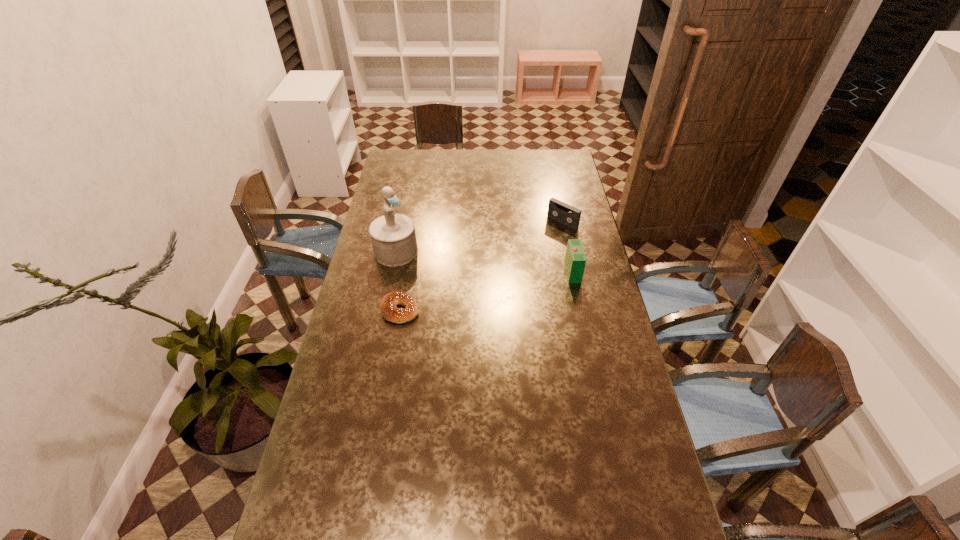
In order to click on bagel in this screenshot , I will do `click(388, 306)`.

The width and height of the screenshot is (960, 540). In order to click on the shortest object in this screenshot , I will do click(388, 306).

At what (x,y) coordinates should I click in order to perform the action: click on the third shortest object. Please return your answer as a coordinate pair (x, y). The width and height of the screenshot is (960, 540). Looking at the image, I should click on coord(575,260).

Locate an element on the screen. The width and height of the screenshot is (960, 540). the tallest object is located at coordinates (393, 237).

At what (x,y) coordinates should I click in order to perform the action: click on the third tallest object. Please return your answer as a coordinate pair (x, y). This screenshot has width=960, height=540. Looking at the image, I should click on (568, 215).

This screenshot has width=960, height=540. I want to click on the farthest object, so click(568, 215).

At what (x,y) coordinates should I click in order to perform the action: click on free space located on the front of the shortest object. Please return your answer as a coordinate pair (x, y). The width and height of the screenshot is (960, 540). Looking at the image, I should click on pos(382,415).

At what (x,y) coordinates should I click in order to perform the action: click on vacant space situated at the beak of the tallest object. Please return your answer as a coordinate pair (x, y). Looking at the image, I should click on (428, 271).

At what (x,y) coordinates should I click in order to perform the action: click on vacant position located 0.230m at the beak of the tallest object. Please return your answer as a coordinate pair (x, y). The width and height of the screenshot is (960, 540). Looking at the image, I should click on (456, 288).

The width and height of the screenshot is (960, 540). I want to click on free space located at the beak of the tallest object, so [490, 309].